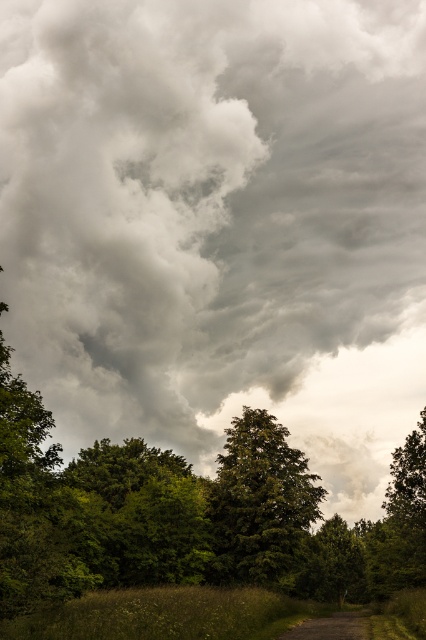
Can you confirm if gray cloudy sky at upper center is taller than green leafy forest at center?

Yes.

Is gray cloudy sky at upper center smaller than green leafy forest at center?

Actually, gray cloudy sky at upper center might be larger than green leafy forest at center.

Is point (362, 124) farther from camera compared to point (8, 445)?

Yes.

You are a GUI agent. You are given a task and a screenshot of the screen. Output one action in this format:
    pyautogui.click(x=<x>, y=<y>)
    Task: Click on the gray cloudy sky at upper center
    
    Given the screenshot: What is the action you would take?
    pyautogui.click(x=216, y=218)

Does green leafy forest at center come behind green leafy tree at center?

No, green leafy forest at center is closer to the viewer.

Describe the element at coordinates (187, 516) in the screenshot. I see `green leafy forest at center` at that location.

Where is `green leafy forest at center`? green leafy forest at center is located at coordinates tap(187, 516).

Is green leafy forest at center smaller than dirt/gravel path at lower center?

No, green leafy forest at center is not smaller than dirt/gravel path at lower center.

This screenshot has height=640, width=426. Identify the location of green leafy forest at center. (187, 516).